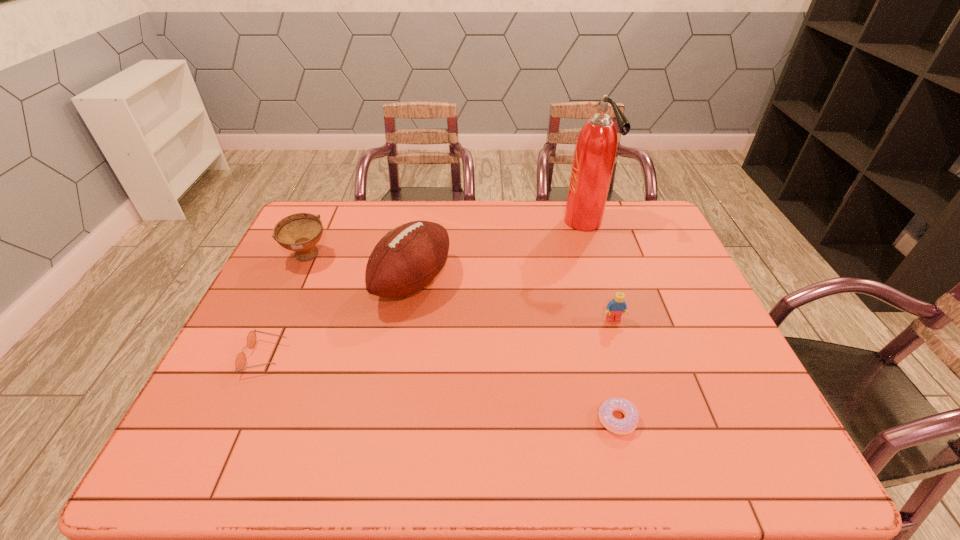
Image resolution: width=960 pixels, height=540 pixels. I want to click on free space located on the left of the fire extinguisher, so click(536, 222).

At what (x,y) coordinates should I click in order to perform the action: click on blank space located 0.140m on the right of the second tallest object. Please return your answer as a coordinate pair (x, y). Image resolution: width=960 pixels, height=540 pixels. Looking at the image, I should click on (497, 282).

Locate an element on the screen. The image size is (960, 540). blank space located 0.320m on the right of the soup bowl is located at coordinates (432, 257).

Where is `vacant space positioned 0.140m on the face of the Lego`? The image size is (960, 540). vacant space positioned 0.140m on the face of the Lego is located at coordinates (628, 367).

The image size is (960, 540). In order to click on vacant space located on the front-facing side of the second nearest object in this screenshot , I will do `click(321, 356)`.

This screenshot has height=540, width=960. Find the location of `free region located 0.380m on the back of the nearest object`. free region located 0.380m on the back of the nearest object is located at coordinates (584, 287).

What are the coordinates of `object present at the far edge` in the screenshot? It's located at (595, 151).

I want to click on object situated at the near edge, so click(x=627, y=425).

The image size is (960, 540). I want to click on soup bowl that is at the left edge, so click(x=300, y=232).

At what (x,y) coordinates should I click in order to perform the action: click on spectacles that is at the left edge. Please return your answer as a coordinate pair (x, y). The height and width of the screenshot is (540, 960). Looking at the image, I should click on (240, 361).